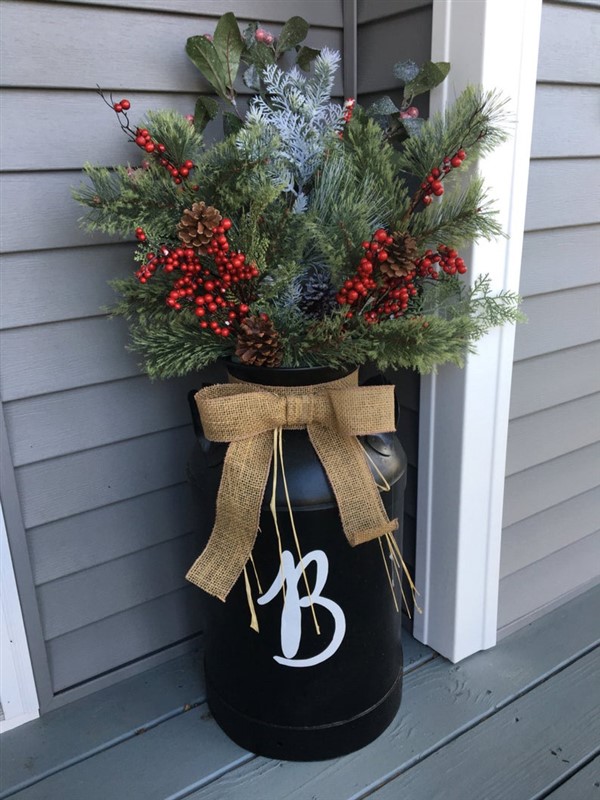
The image size is (600, 800). Identify the location of wall. (128, 446).